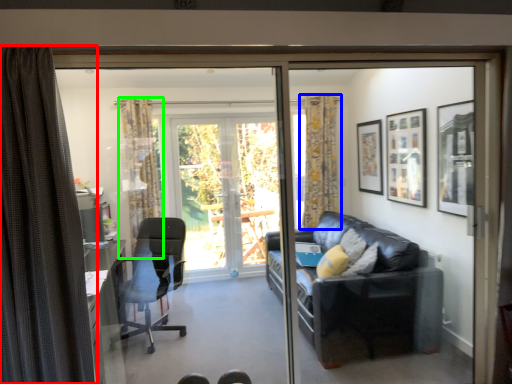
Question: Estimate the real-world distances between objects in this image. Which object is closer to curtain (highlighted by a red box), curtain (highlighted by a blue box) or curtain (highlighted by a green box)?

Choices:
 (A) curtain
 (B) curtain

Answer: (B)